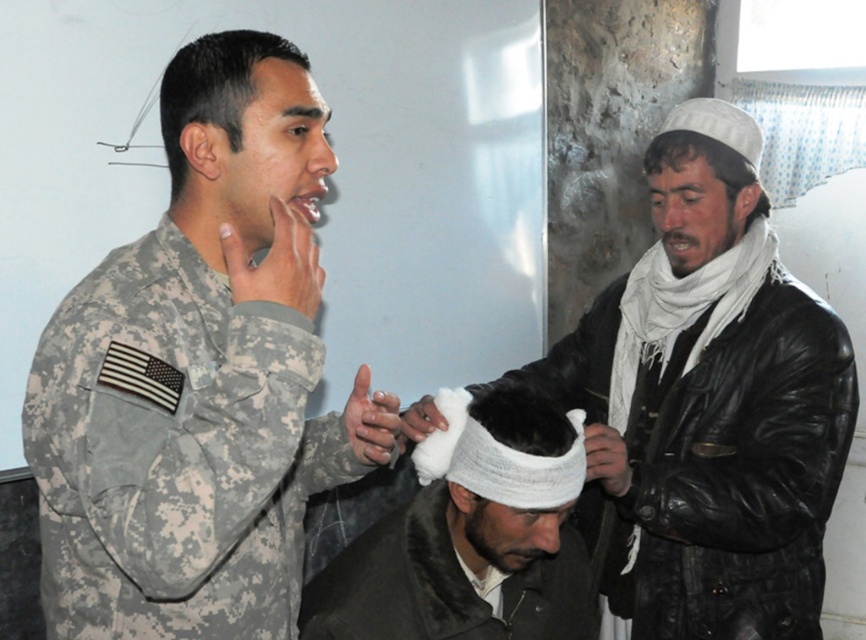
Question: Where is white matte headband at center located in relation to matte skin forehead at center in the image?

Choices:
 (A) below
 (B) above

Answer: (A)

Question: Which of the following is the farthest from the observer?

Choices:
 (A) white bandaged head at center
 (B) white bandage at center
 (C) white cotton turban at upper right

Answer: (C)

Question: Does white soft scarf at upper right appear over white cotton turban at upper right?

Choices:
 (A) yes
 (B) no

Answer: (B)

Question: Is white bandaged head at center behind camouflage uniform at left?

Choices:
 (A) yes
 (B) no

Answer: (A)

Question: Among these objects, which one is nearest to the camera?

Choices:
 (A) camouflage uniform at left
 (B) camouflage uniform at center
 (C) white matte headband at center
 (D) white bandage at center

Answer: (B)

Question: Based on their relative distances, which object is nearer to the matte skin forehead at center?

Choices:
 (A) white bandaged head at center
 (B) camouflage uniform at center
 (C) camouflage uniform at left

Answer: (C)